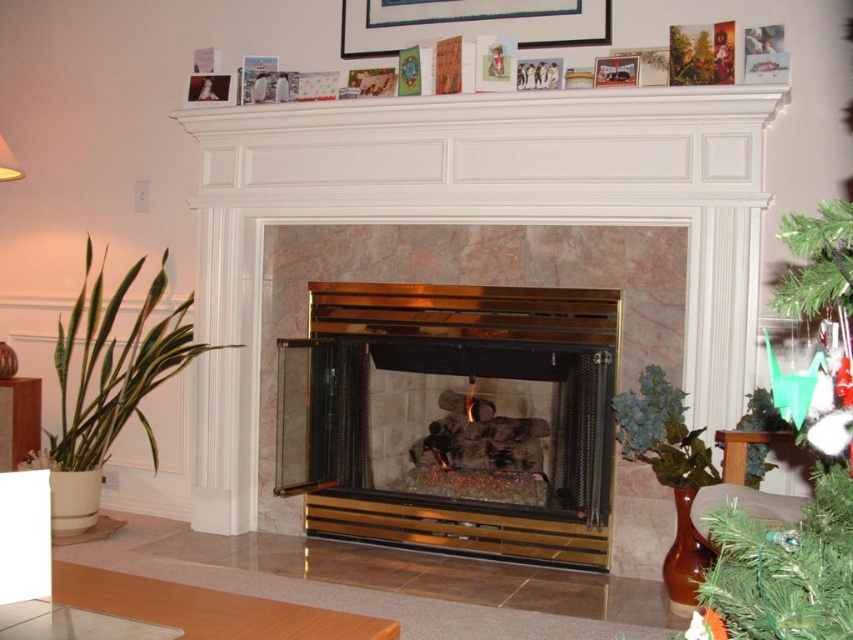
From the picture: Can you confirm if wooden picture frame at upper center is positioned above metallic silver picture frame at upper center?

Indeed, wooden picture frame at upper center is positioned over metallic silver picture frame at upper center.

Is wooden picture frame at upper center bigger than metallic silver picture frame at upper center?

Indeed, wooden picture frame at upper center has a larger size compared to metallic silver picture frame at upper center.

This screenshot has width=853, height=640. What do you see at coordinates (469, 22) in the screenshot? I see `wooden picture frame at upper center` at bounding box center [469, 22].

I want to click on wooden picture frame at upper center, so click(x=469, y=22).

How distant is gold metallic fireplace at center from metallic photo frame at upper center?

gold metallic fireplace at center and metallic photo frame at upper center are 5.66 feet apart from each other.

Does gold metallic fireplace at center appear over metallic photo frame at upper center?

No.

Where is `gold metallic fireplace at center`? gold metallic fireplace at center is located at coordinates (453, 419).

Is metallic photo frame at upper center to the right of matte gold lampshade at upper left from the viewer's perspective?

Indeed, metallic photo frame at upper center is positioned on the right side of matte gold lampshade at upper left.

Does point (213, 93) come closer to viewer compared to point (7, 166)?

No, (213, 93) is behind (7, 166).

Locate an element on the screen. The image size is (853, 640). metallic photo frame at upper center is located at coordinates (207, 88).